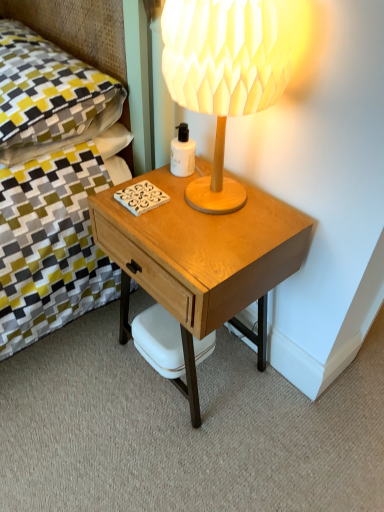
The width and height of the screenshot is (384, 512). What do you see at coordinates (159, 341) in the screenshot?
I see `white matte coffee cup at lower center` at bounding box center [159, 341].

Looking at this image, measure the distance between point (185, 139) and camera.

Point (185, 139) is 3.60 feet from camera.

What do you see at coordinates (223, 74) in the screenshot?
I see `wooden lampshade at upper right` at bounding box center [223, 74].

Where is `yellow-green fabric pillow at upper left`? The image size is (384, 512). yellow-green fabric pillow at upper left is located at coordinates (49, 96).

Can you confirm if white matte bottle at center is positioned to the left of wooden lampshade at upper right?

Yes, white matte bottle at center is to the left of wooden lampshade at upper right.

Does white matte bottle at center lie in front of wooden lampshade at upper right?

No, it is behind wooden lampshade at upper right.

Is white matte bottle at center far from wooden lampshade at upper right?

No, there isn't a large distance between white matte bottle at center and wooden lampshade at upper right.

Can you confirm if wooden lampshade at upper right is shorter than yellow-green fabric pillow at upper left?

In fact, wooden lampshade at upper right may be taller than yellow-green fabric pillow at upper left.

From the image's perspective, between wooden lampshade at upper right and yellow-green fabric pillow at upper left, who is located below?

From the image's view, wooden lampshade at upper right is below.

Would you say wooden lampshade at upper right is a long distance from yellow-green fabric pillow at upper left?

No.

Is white matte coffee cup at lower center facing towards light brown wood desk at center?

Yes, white matte coffee cup at lower center is turned towards light brown wood desk at center.

Is white matte coffee cup at lower center smaller than light brown wood desk at center?

Yes, white matte coffee cup at lower center is smaller than light brown wood desk at center.

Is white matte coffee cup at lower center inside or outside of light brown wood desk at center?

white matte coffee cup at lower center fits inside light brown wood desk at center.

Where is `desk that is in front of the white matte coffee cup at lower center`? desk that is in front of the white matte coffee cup at lower center is located at coordinates (201, 261).

Considering the positions of objects white matte coffee cup at lower center and wooden lampshade at upper right in the image provided, who is more to the left, white matte coffee cup at lower center or wooden lampshade at upper right?

Positioned to the left is white matte coffee cup at lower center.

Based on the photo, would you say white matte coffee cup at lower center is outside wooden lampshade at upper right?

Yes.

Which is behind, white matte coffee cup at lower center or wooden lampshade at upper right?

white matte coffee cup at lower center is further from the camera.

Looking at this image, can you confirm if light brown wood desk at center is taller than white matte coffee cup at lower center?

Indeed, light brown wood desk at center has a greater height compared to white matte coffee cup at lower center.

Considering the positions of objects light brown wood desk at center and white matte coffee cup at lower center in the image provided, who is more to the right, light brown wood desk at center or white matte coffee cup at lower center?

Result: From the viewer's perspective, light brown wood desk at center appears more on the right side.

Which of these two, light brown wood desk at center or white matte coffee cup at lower center, is bigger?

light brown wood desk at center.

Considering the relative sizes of light brown wood desk at center and white matte coffee cup at lower center in the image provided, is light brown wood desk at center thinner than white matte coffee cup at lower center?

No, light brown wood desk at center is not thinner than white matte coffee cup at lower center.

Is yellow-green fabric pillow at upper left turned away from light brown wood desk at center?

yellow-green fabric pillow at upper left is not turned away from light brown wood desk at center.

From the image's perspective, who appears lower, yellow-green fabric pillow at upper left or light brown wood desk at center?

light brown wood desk at center.

Is yellow-green fabric pillow at upper left not near light brown wood desk at center?

yellow-green fabric pillow at upper left is actually quite close to light brown wood desk at center.

From a real-world perspective, relative to light brown wood desk at center, is yellow-green fabric pillow at upper left vertically above or below?

Clearly, from a real-world perspective, yellow-green fabric pillow at upper left is above light brown wood desk at center.

From the image's perspective, which is below, wooden lampshade at upper right or light brown wood desk at center?

light brown wood desk at center.

Considering the sizes of objects wooden lampshade at upper right and light brown wood desk at center in the image provided, who is bigger, wooden lampshade at upper right or light brown wood desk at center?

light brown wood desk at center.

In terms of height, does wooden lampshade at upper right look taller or shorter compared to light brown wood desk at center?

In the image, wooden lampshade at upper right appears to be shorter than light brown wood desk at center.

The height and width of the screenshot is (512, 384). What are the coordinates of `lamp on the right of white matte bottle at center` in the screenshot? It's located at 223,74.

The image size is (384, 512). I want to click on pillow on the left of wooden lampshade at upper right, so click(49, 96).

When comparing their distances from white matte bottle at center, does wooden lampshade at upper right or light brown wood desk at center seem closer?

wooden lampshade at upper right is closer to white matte bottle at center.

Which object lies further to the anchor point wooden lampshade at upper right, yellow-green fabric pillow at upper left or white matte coffee cup at lower center?

white matte coffee cup at lower center lies further to wooden lampshade at upper right than the other object.

Estimate the real-world distances between objects in this image. Which object is closer to wooden lampshade at upper right, light brown wood desk at center or yellow-green fabric pillow at upper left?

light brown wood desk at center is positioned closer to the anchor wooden lampshade at upper right.

Which object lies further to the anchor point light brown wood desk at center, yellow-green fabric pillow at upper left or white matte coffee cup at lower center?

Among the two, yellow-green fabric pillow at upper left is located further to light brown wood desk at center.

From the image, which object appears to be nearer to white matte coffee cup at lower center, white matte bottle at center or wooden lampshade at upper right?

white matte bottle at center.

Looking at the image, which one is located closer to white matte bottle at center, yellow-green fabric pillow at upper left or wooden lampshade at upper right?

Among the two, wooden lampshade at upper right is located nearer to white matte bottle at center.

Based on their spatial positions, is yellow-green fabric pillow at upper left or white matte bottle at center further from white matte coffee cup at lower center?

Among the two, yellow-green fabric pillow at upper left is located further to white matte coffee cup at lower center.

When comparing their distances from light brown wood desk at center, does wooden lampshade at upper right or yellow-green fabric pillow at upper left seem further?

yellow-green fabric pillow at upper left is positioned further to the anchor light brown wood desk at center.

Locate an element on the screen. The width and height of the screenshot is (384, 512). desk that lies between white matte bottle at center and white matte coffee cup at lower center from top to bottom is located at coordinates (201, 261).

At what (x,y) coordinates should I click in order to perform the action: click on bottle that lies between yellow-green fabric pillow at upper left and white matte coffee cup at lower center from top to bottom. Please return your answer as a coordinate pair (x, y). This screenshot has height=512, width=384. Looking at the image, I should click on (182, 153).

At what (x,y) coordinates should I click in order to perform the action: click on bottle between yellow-green fabric pillow at upper left and wooden lampshade at upper right. Please return your answer as a coordinate pair (x, y). This screenshot has width=384, height=512. Looking at the image, I should click on (182, 153).

Find the location of a particular element. bottle between wooden lampshade at upper right and light brown wood desk at center in the up-down direction is located at coordinates (182, 153).